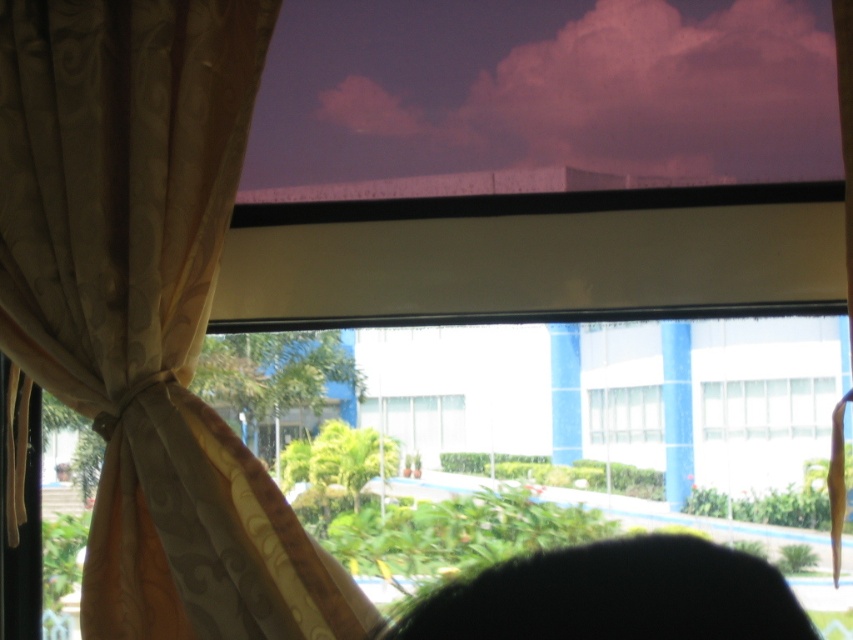
Question: Among these points, which one is nearest to the camera?

Choices:
 (A) (160, 102)
 (B) (596, 99)
 (C) (813, 419)
 (D) (440, 588)

Answer: (D)

Question: Estimate the real-world distances between objects in this image. Which object is closer to the black hair at lower center?

Choices:
 (A) transparent glass window at center
 (B) purple fabric blind at upper center
 (C) white glass window at center
 (D) silky beige curtain at left

Answer: (D)

Question: Does silky beige curtain at left have a greater width compared to black hair at lower center?

Choices:
 (A) no
 (B) yes

Answer: (B)

Question: Is silky beige curtain at left wider than transparent glass window at center?

Choices:
 (A) yes
 (B) no

Answer: (A)

Question: Which object appears farthest from the camera in this image?

Choices:
 (A) purple fabric blind at upper center
 (B) transparent glass window at center
 (C) white glass window at center
 (D) black hair at lower center

Answer: (B)

Question: Does silky beige curtain at left have a smaller size compared to black hair at lower center?

Choices:
 (A) no
 (B) yes

Answer: (A)